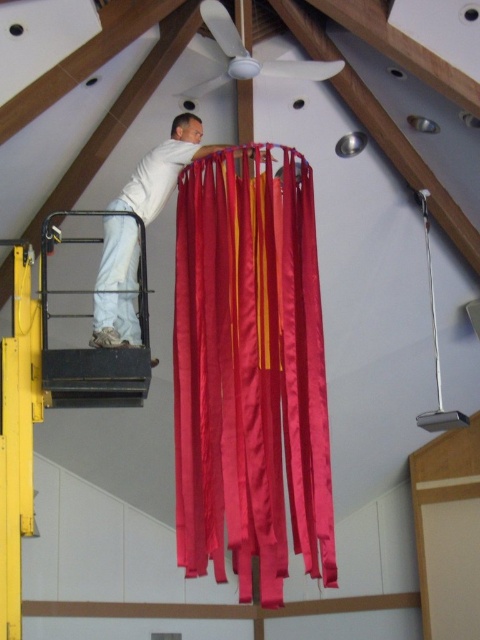
Question: Which object appears farthest from the camera in this image?

Choices:
 (A) black metal lift at lower left
 (B) white matte pants at center

Answer: (B)

Question: Is satin red curtain at center bigger than white matte fan at upper center?

Choices:
 (A) yes
 (B) no

Answer: (A)

Question: Which point is closer to the camera?

Choices:
 (A) (128, 243)
 (B) (148, 371)
 (C) (220, 35)
 (D) (308, 454)

Answer: (B)

Question: From the image, what is the correct spatial relationship of satin red curtain at center in relation to white matte pants at center?

Choices:
 (A) above
 (B) below

Answer: (B)

Question: Does black metal lift at lower left have a greater width compared to white matte fan at upper center?

Choices:
 (A) yes
 (B) no

Answer: (B)

Question: Which point appears farthest from the camera in this image?

Choices:
 (A) (214, 147)
 (B) (244, 403)

Answer: (A)